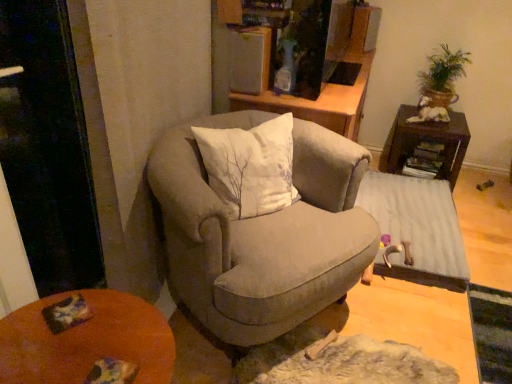
Question: Can you confirm if dark brown wood side table at right, the second table in the bottom-to-top sequence, is smaller than white ceramic dog at upper right?

Choices:
 (A) no
 (B) yes

Answer: (A)

Question: Could you tell me if dark brown wood side table at right, the second table in the bottom-to-top sequence, is turned towards white ceramic dog at upper right?

Choices:
 (A) no
 (B) yes

Answer: (A)

Question: From a real-world perspective, is dark brown wood side table at right, the 1th table when ordered from top to bottom, over white ceramic dog at upper right?

Choices:
 (A) yes
 (B) no

Answer: (B)

Question: Is dark brown wood side table at right, the second table in the bottom-to-top sequence, further to the viewer compared to white ceramic dog at upper right?

Choices:
 (A) yes
 (B) no

Answer: (B)

Question: Does dark brown wood side table at right, the 1th table when ordered from top to bottom, have a greater width compared to white ceramic dog at upper right?

Choices:
 (A) yes
 (B) no

Answer: (A)

Question: From their relative heights in the image, would you say green leafy plant at upper right is taller or shorter than dark brown wood side table at right, the 1th table when ordered from top to bottom?

Choices:
 (A) short
 (B) tall

Answer: (B)

Question: Considering their positions, is green leafy plant at upper right located in front of or behind dark brown wood side table at right, the second table in the bottom-to-top sequence?

Choices:
 (A) behind
 (B) front

Answer: (B)

Question: Considering the positions of green leafy plant at upper right and dark brown wood side table at right, the second table in the bottom-to-top sequence, in the image, is green leafy plant at upper right wider or thinner than dark brown wood side table at right, the second table in the bottom-to-top sequence,?

Choices:
 (A) thin
 (B) wide

Answer: (A)

Question: From a real-world perspective, is green leafy plant at upper right above or below dark brown wood side table at right, the 1th table when ordered from top to bottom?

Choices:
 (A) above
 (B) below

Answer: (A)

Question: Is point (342, 170) positioned closer to the camera than point (36, 370)?

Choices:
 (A) closer
 (B) farther

Answer: (B)

Question: Would you say velvet beige armchair at center is inside or outside orange wooden desk at lower left?

Choices:
 (A) inside
 (B) outside

Answer: (B)

Question: From their relative heights in the image, would you say velvet beige armchair at center is taller or shorter than orange wooden desk at lower left?

Choices:
 (A) tall
 (B) short

Answer: (A)

Question: In the image, is velvet beige armchair at center positioned in front of or behind orange wooden desk at lower left?

Choices:
 (A) behind
 (B) front

Answer: (A)

Question: From a real-world perspective, is green leafy plant at upper right positioned above or below orange wooden desk at lower left?

Choices:
 (A) above
 (B) below

Answer: (A)

Question: In the image, is green leafy plant at upper right positioned in front of or behind orange wooden desk at lower left?

Choices:
 (A) behind
 (B) front

Answer: (A)